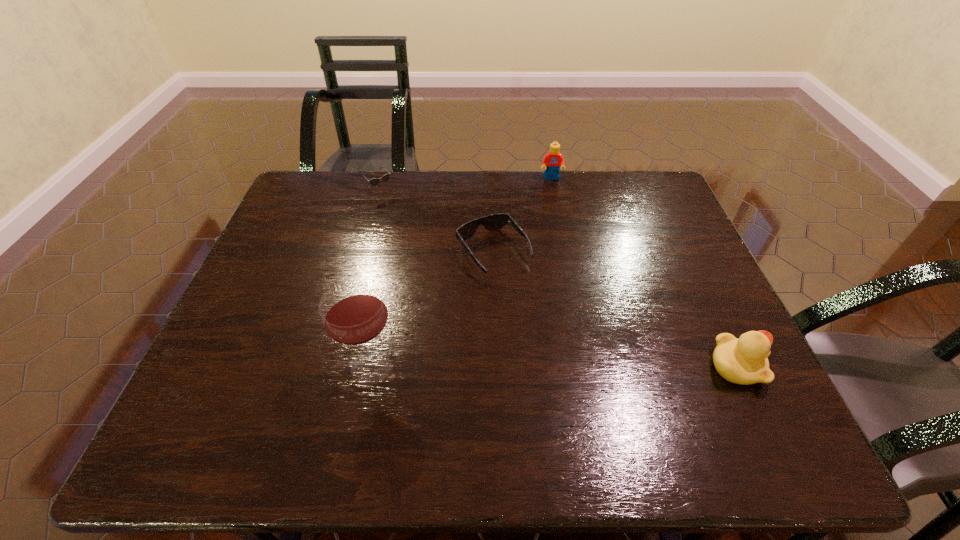
Identify the location of free spot between the tallest object and the third farthest object. (432, 310).

You are a GUI agent. You are given a task and a screenshot of the screen. Output one action in this format:
    pyautogui.click(x=<x>, y=<y>)
    Task: Click on the unoccupied position between the left sunglasses and the third nearest object
    The width and height of the screenshot is (960, 540).
    Given the screenshot: What is the action you would take?
    pyautogui.click(x=439, y=223)

I want to click on free space between the second object from right to left and the tallest object, so click(462, 273).

Locate an element on the screen. vacant space that is in between the nearer sunglasses and the second shortest object is located at coordinates (439, 223).

This screenshot has height=540, width=960. Find the location of `free spot between the Lego and the taller sunglasses`. free spot between the Lego and the taller sunglasses is located at coordinates (468, 186).

Locate an element on the screen. The image size is (960, 540). vacant area that lies between the third object from right to left and the tallest object is located at coordinates point(432,310).

Where is `free space between the fourth shortest object and the right sunglasses`? free space between the fourth shortest object and the right sunglasses is located at coordinates (522, 215).

Where is `free point between the taller sunglasses and the fourth shortest object`? free point between the taller sunglasses and the fourth shortest object is located at coordinates (x=468, y=186).

Locate an element on the screen. free space between the Lego and the tallest object is located at coordinates (462, 273).

Locate an element on the screen. The width and height of the screenshot is (960, 540). vacant area that lies between the left sunglasses and the fourth shortest object is located at coordinates (468, 186).